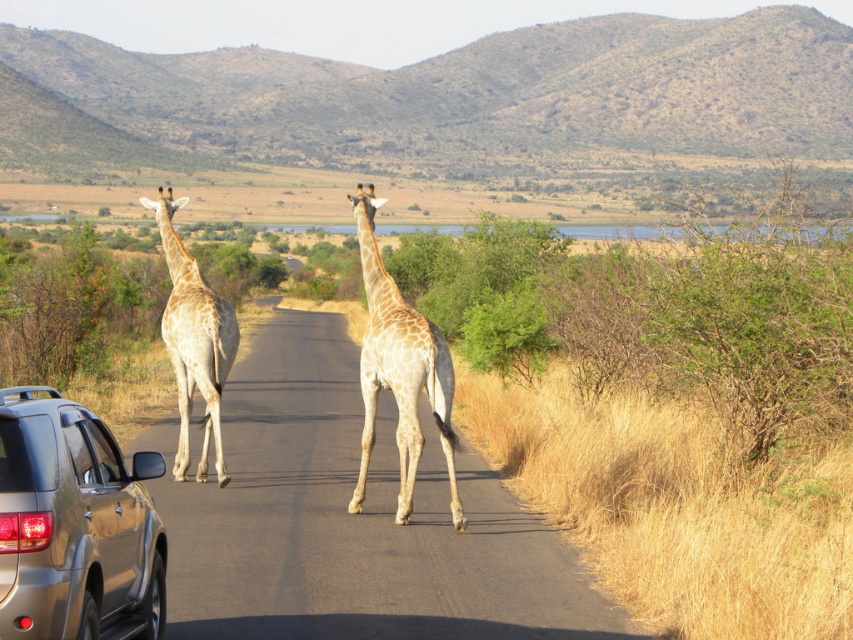
Does satin silver car at lower left appear on the left side of light brown spotted giraffe at center?

Indeed, satin silver car at lower left is positioned on the left side of light brown spotted giraffe at center.

Between satin silver car at lower left and light brown spotted giraffe at center, which one is positioned lower?

satin silver car at lower left is below.

At what (x,y) coordinates should I click in order to perform the action: click on satin silver car at lower left. Please return your answer as a coordinate pair (x, y). The image size is (853, 640). Looking at the image, I should click on (74, 525).

Where is `satin silver car at lower left`? satin silver car at lower left is located at coordinates (74, 525).

Does point (413, 312) lie in front of point (169, 227)?

Yes.

Can you confirm if light brown spotted giraffe at center is bigger than light brown textured giraffe at center?

Actually, light brown spotted giraffe at center might be smaller than light brown textured giraffe at center.

What do you see at coordinates (399, 369) in the screenshot? This screenshot has width=853, height=640. I see `light brown spotted giraffe at center` at bounding box center [399, 369].

The height and width of the screenshot is (640, 853). I want to click on light brown spotted giraffe at center, so click(399, 369).

In the scene shown: Does satin silver car at lower left have a lesser width compared to light brown textured giraffe at center?

Indeed, satin silver car at lower left has a lesser width compared to light brown textured giraffe at center.

Does satin silver car at lower left have a lesser height compared to light brown textured giraffe at center?

Correct, satin silver car at lower left is not as tall as light brown textured giraffe at center.

Which is behind, point (3, 576) or point (206, 372)?

The point (206, 372) is behind.

Image resolution: width=853 pixels, height=640 pixels. Identify the location of satin silver car at lower left. tap(74, 525).